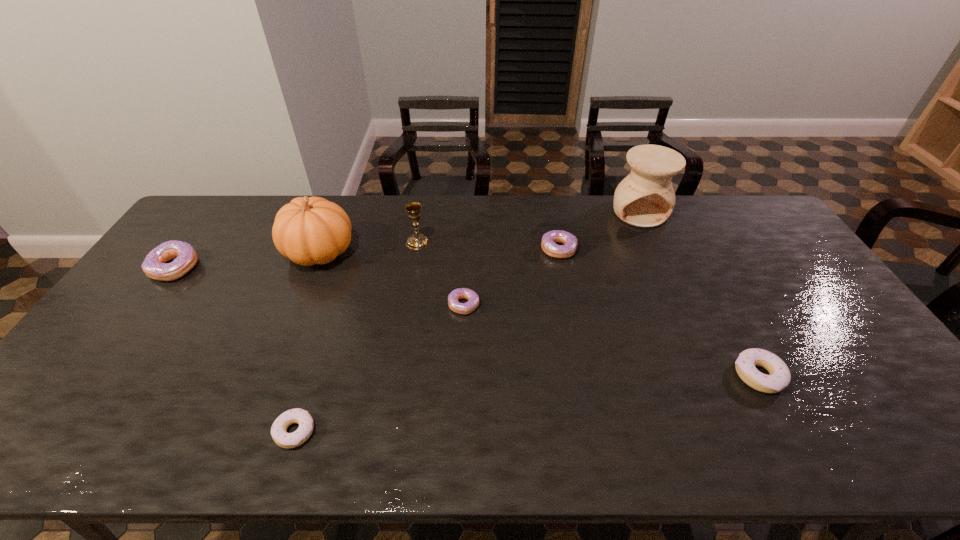
Identify the location of free space that satisfies the following two spatial constraints: 1. on the back side of the nearest object; 2. on the right side of the nearest purple doughnut. The width and height of the screenshot is (960, 540). (335, 305).

The height and width of the screenshot is (540, 960). Identify the location of free point that satisfies the following two spatial constraints: 1. on the front side of the leftmost purple doughnut; 2. on the right side of the second nearest object. (96, 375).